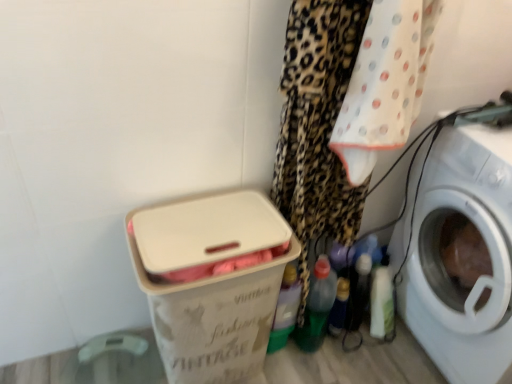
Question: Is white plastic washing machine at right aimed at white plastic laundry basket at lower left?

Choices:
 (A) no
 (B) yes

Answer: (B)

Question: From the image's perspective, is white plastic washing machine at right located above white plastic laundry basket at lower left?

Choices:
 (A) yes
 (B) no

Answer: (A)

Question: Is white plastic washing machine at right to the right of white plastic laundry basket at lower left from the viewer's perspective?

Choices:
 (A) no
 (B) yes

Answer: (B)

Question: Is white plastic washing machine at right positioned beyond the bounds of white plastic laundry basket at lower left?

Choices:
 (A) no
 (B) yes

Answer: (B)

Question: Is white plastic washing machine at right bigger than white plastic laundry basket at lower left?

Choices:
 (A) yes
 (B) no

Answer: (A)

Question: From the image's perspective, is white plastic washing machine at right located above or below translucent plastic bottle at lower center?

Choices:
 (A) below
 (B) above

Answer: (B)

Question: Visually, is white plastic washing machine at right positioned to the left or to the right of translucent plastic bottle at lower center?

Choices:
 (A) right
 (B) left

Answer: (A)

Question: Is white plastic washing machine at right taller or shorter than translucent plastic bottle at lower center?

Choices:
 (A) short
 (B) tall

Answer: (B)

Question: From a real-world perspective, is white plastic washing machine at right physically located above or below translucent plastic bottle at lower center?

Choices:
 (A) below
 (B) above

Answer: (B)

Question: Relative to translucent plastic bottle at lower center, is white plastic laundry basket at lower left in front or behind?

Choices:
 (A) front
 (B) behind

Answer: (A)

Question: Do you think white plastic laundry basket at lower left is within translucent plastic bottle at lower center, or outside of it?

Choices:
 (A) outside
 (B) inside

Answer: (A)

Question: Would you say white plastic laundry basket at lower left is to the left or to the right of translucent plastic bottle at lower center in the picture?

Choices:
 (A) right
 (B) left

Answer: (B)

Question: From the image's perspective, is white plastic laundry basket at lower left positioned above or below translucent plastic bottle at lower center?

Choices:
 (A) above
 (B) below

Answer: (A)

Question: Does point (336, 297) appear closer or farther from the camera than point (465, 340)?

Choices:
 (A) closer
 (B) farther

Answer: (B)

Question: From the image's perspective, relative to white plastic washing machine at right, is translucent plastic bottle at lower center above or below?

Choices:
 (A) below
 (B) above

Answer: (A)